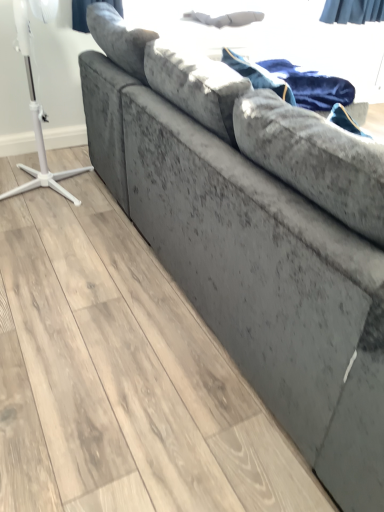
Locate an element on the screen. The height and width of the screenshot is (512, 384). vacant space in front of white plastic tripod at left is located at coordinates click(46, 221).